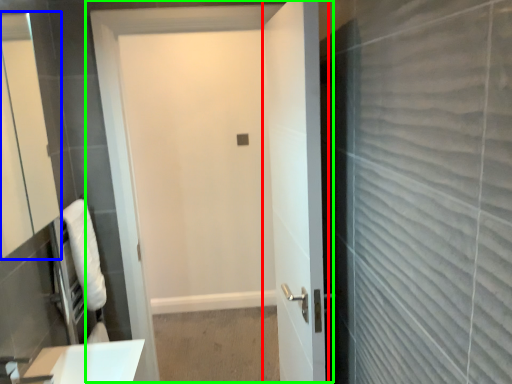
Question: Estimate the real-world distances between objects in this image. Which object is closer to door (highlighted by a red box), mirror (highlighted by a blue box) or door (highlighted by a green box)?

Choices:
 (A) mirror
 (B) door

Answer: (B)